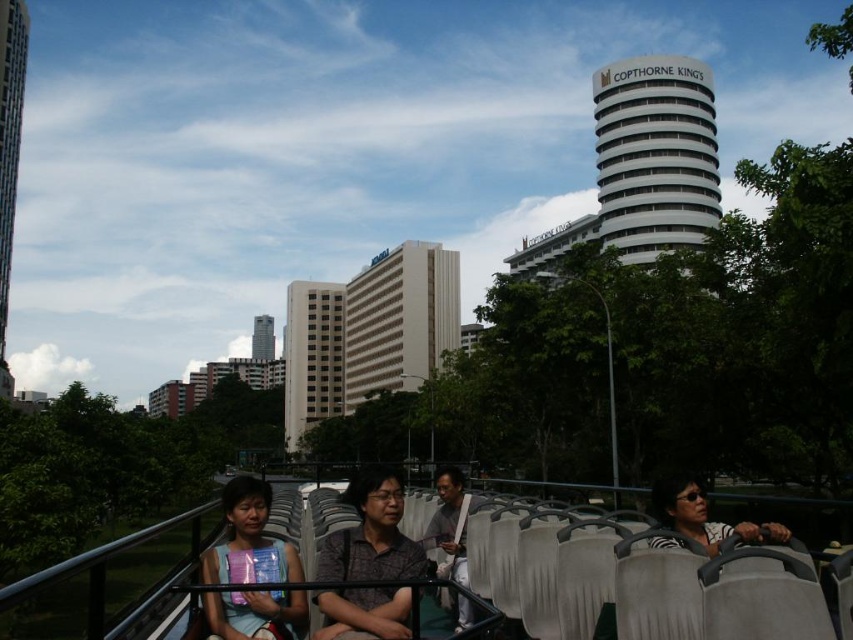
Consider the image. Is matte black shirt at center bigger than gray fabric bag at center?

No.

Does matte black shirt at center have a greater width compared to gray fabric bag at center?

Indeed, matte black shirt at center has a greater width compared to gray fabric bag at center.

Between point (228, 483) and point (460, 509), which one is positioned in front?

Point (460, 509)

The image size is (853, 640). I want to click on matte black shirt at center, so click(248, 540).

Is black plastic rail at lower center shorter than zebra print shirt at center?

No, black plastic rail at lower center is not shorter than zebra print shirt at center.

Does black plastic rail at lower center appear on the left side of zebra print shirt at center?

Correct, you'll find black plastic rail at lower center to the left of zebra print shirt at center.

Is point (508, 593) in front of point (653, 497)?

No.

Locate an element on the screen. black plastic rail at lower center is located at coordinates (608, 577).

Is the position of dark gray fabric shirt at center more distant than that of matte black shirt at center?

Yes, dark gray fabric shirt at center is behind matte black shirt at center.

Is point (334, 628) in front of point (283, 620)?

Yes, it is in front of point (283, 620).

You are a GUI agent. You are given a task and a screenshot of the screen. Output one action in this format:
    pyautogui.click(x=<x>, y=<y>)
    Task: Click on the dark gray fabric shirt at center
    
    Given the screenshot: What is the action you would take?
    pyautogui.click(x=370, y=536)